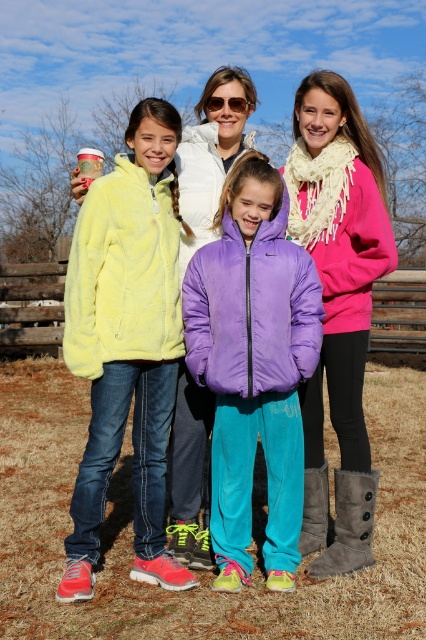
Please look at the image and identify the exact location of the matte pink jacket at center. Provide the coordinates as a point in the format of point followed by the coordinates in parentheses, like point (339,228).

The matte pink jacket at center is located at point (339,228).